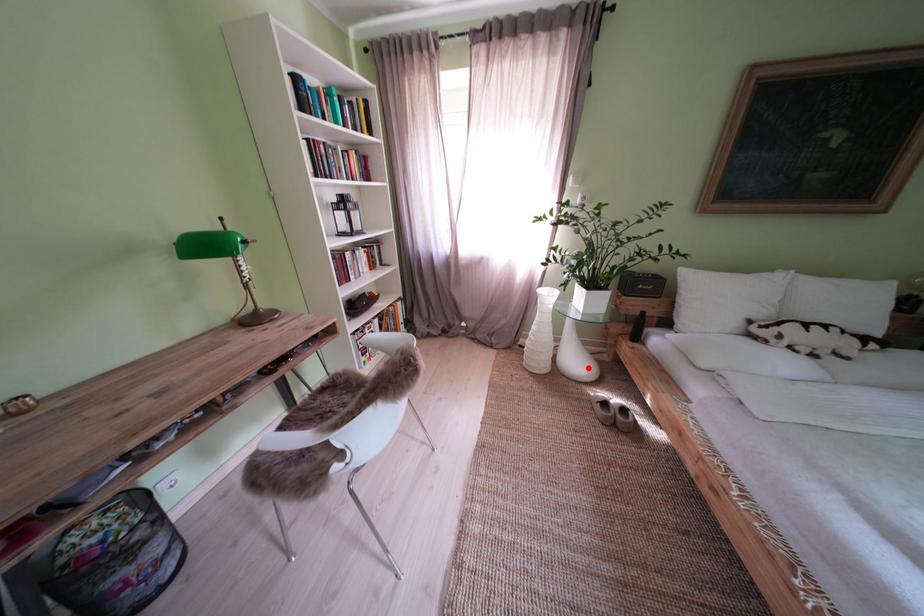
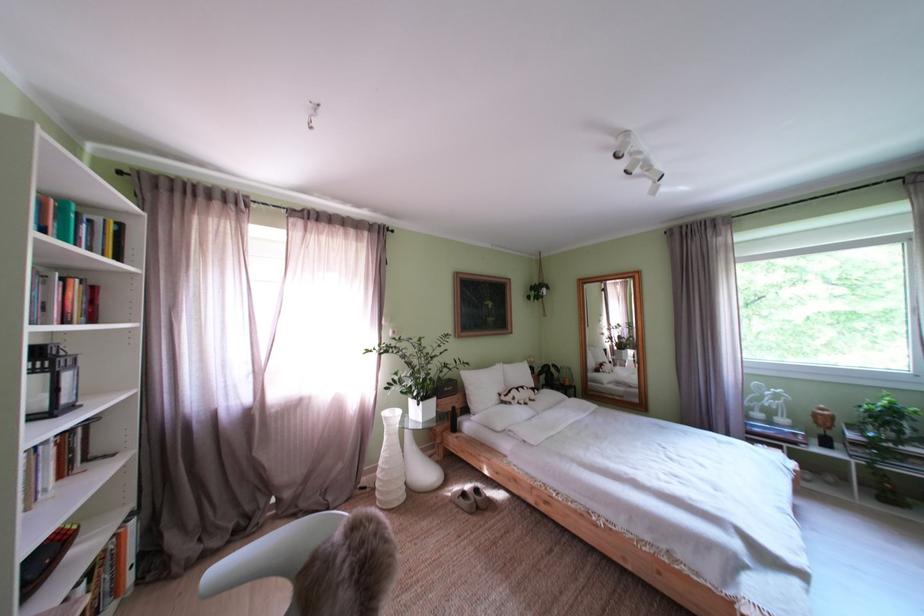
Locate, in the second image, the point that corresponds to the highlighted location in the first image.

(438, 479)